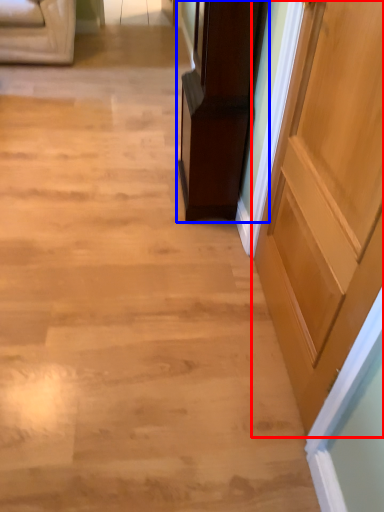
Question: Which object appears farthest to the camera in this image, door (highlighted by a red box) or furniture (highlighted by a blue box)?

Choices:
 (A) door
 (B) furniture

Answer: (B)